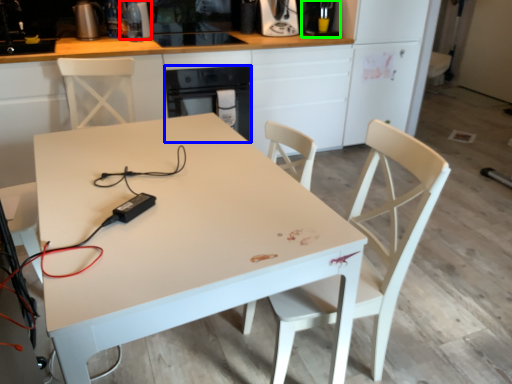
Question: Estimate the real-world distances between objects in this image. Which object is closer to appliance (highlighted by a red box), oven (highlighted by a blue box) or coffee machine (highlighted by a green box)?

Choices:
 (A) oven
 (B) coffee machine

Answer: (A)